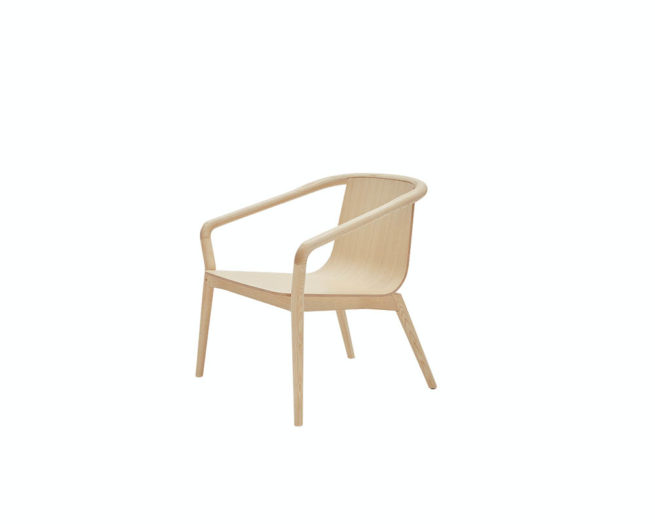
I want to click on seat back, so click(371, 233).